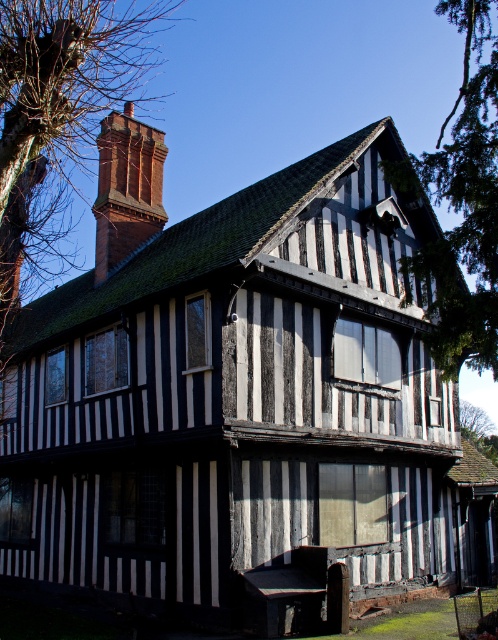
Question: Is green leafy tree at upper right thinner than brick chimney at upper left?

Choices:
 (A) no
 (B) yes

Answer: (A)

Question: Among these points, which one is farthest from the camera?

Choices:
 (A) (469, 221)
 (B) (104, 168)

Answer: (B)

Question: Among these objects, which one is nearest to the camera?

Choices:
 (A) brick chimney at upper left
 (B) green leafy tree at upper right

Answer: (B)

Question: In this image, where is green leafy tree at upper right located relative to brick chimney at upper left?

Choices:
 (A) below
 (B) above

Answer: (B)

Question: Does green leafy tree at upper right appear over brick chimney at upper left?

Choices:
 (A) no
 (B) yes

Answer: (B)